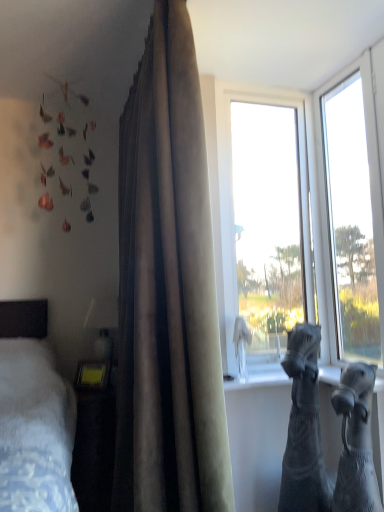
Where is `satin-like beige curtain at center`? The width and height of the screenshot is (384, 512). satin-like beige curtain at center is located at coordinates (168, 289).

The width and height of the screenshot is (384, 512). What do you see at coordinates (168, 289) in the screenshot?
I see `satin-like beige curtain at center` at bounding box center [168, 289].

Where is `transparent glass window at upper right, placed as the first window when sorted from right to left`? The height and width of the screenshot is (512, 384). transparent glass window at upper right, placed as the first window when sorted from right to left is located at coordinates (354, 213).

You are a GUI agent. You are given a task and a screenshot of the screen. Output one action in this format:
    pyautogui.click(x=<x>, y=<y>)
    Task: Click on the satin-like beige curtain at center
    The height and width of the screenshot is (512, 384).
    Given the screenshot: What is the action you would take?
    pyautogui.click(x=168, y=289)

From a real-world perspective, is satin-like beige curtain at center positioned over transparent glass window at upper right, placed as the first window when sorted from right to left, based on gravity?

No, from a real-world perspective, satin-like beige curtain at center is not on top of transparent glass window at upper right, placed as the first window when sorted from right to left.

Image resolution: width=384 pixels, height=512 pixels. I want to click on the 1st window behind when counting from the satin-like beige curtain at center, so click(354, 213).

How different are the orientations of satin-like beige curtain at center and transparent glass window at upper right, placed as the first window when sorted from right to left, in degrees?

They differ by 0.187 degrees in their facing directions.

Is satin-like beige curtain at center facing away from transparent glass window at upper right, which is the 2th window from left to right?

Yes, satin-like beige curtain at center's orientation is away from transparent glass window at upper right, which is the 2th window from left to right.

Does transparent glass window at upper right, positioned as the first window in left-to-right order, have a smaller size compared to transparent glass window at upper right, placed as the first window when sorted from right to left?

Incorrect, transparent glass window at upper right, positioned as the first window in left-to-right order, is not smaller in size than transparent glass window at upper right, placed as the first window when sorted from right to left.

How far apart are transparent glass window at upper right, positioned as the first window in left-to-right order, and transparent glass window at upper right, placed as the first window when sorted from right to left?

The distance of transparent glass window at upper right, positioned as the first window in left-to-right order, from transparent glass window at upper right, placed as the first window when sorted from right to left, is 14.71 centimeters.

What's the angular difference between transparent glass window at upper right, which is counted as the second window, starting from the right, and transparent glass window at upper right, placed as the first window when sorted from right to left,'s facing directions?

The angular difference between transparent glass window at upper right, which is counted as the second window, starting from the right, and transparent glass window at upper right, placed as the first window when sorted from right to left, is 90 degrees.

Is transparent glass window at upper right, which is counted as the second window, starting from the right, with transparent glass window at upper right, placed as the first window when sorted from right to left?

No, transparent glass window at upper right, which is counted as the second window, starting from the right, is not touching transparent glass window at upper right, placed as the first window when sorted from right to left.

Is transparent glass window at upper right, which is counted as the second window, starting from the right, positioned before satin-like beige curtain at center?

No, the depth of transparent glass window at upper right, which is counted as the second window, starting from the right, is greater than that of satin-like beige curtain at center.

Can you confirm if transparent glass window at upper right, positioned as the first window in left-to-right order, is positioned to the right of satin-like beige curtain at center?

Yes.

From the picture: How much distance is there between transparent glass window at upper right, which is counted as the second window, starting from the right, and satin-like beige curtain at center?

They are 65.28 centimeters apart.

Consider the image. What's the angular difference between transparent glass window at upper right, positioned as the first window in left-to-right order, and satin-like beige curtain at center's facing directions?

transparent glass window at upper right, positioned as the first window in left-to-right order, and satin-like beige curtain at center are facing 89.8 degrees away from each other.

Which is closer, (350, 386) or (141, 152)?

The point (350, 386) is more forward.

Could satin-like beige curtain at center be considered to be inside black knitted socks at lower right, positioned as the 1th animal in front-to-back order?

No, satin-like beige curtain at center is located outside of black knitted socks at lower right, positioned as the 1th animal in front-to-back order.

From a real-world perspective, is black knitted socks at lower right, positioned as the second animal in back-to-front order, above or below satin-like beige curtain at center?

black knitted socks at lower right, positioned as the second animal in back-to-front order, is situated lower than satin-like beige curtain at center in the real world.

Which is more to the right, black knitted socks at lower right, positioned as the 1th animal in front-to-back order, or satin-like beige curtain at center?

From the viewer's perspective, black knitted socks at lower right, positioned as the 1th animal in front-to-back order, appears more on the right side.

Could you tell me if transparent glass window at upper right, placed as the first window when sorted from right to left, is turned towards black denim jeans at lower right, the first animal positioned from the back?

Yes, transparent glass window at upper right, placed as the first window when sorted from right to left, is aimed at black denim jeans at lower right, the first animal positioned from the back.

From a real-world perspective, which object stands above the other?

transparent glass window at upper right, which is the 2th window from left to right, is physically above.

Is transparent glass window at upper right, placed as the first window when sorted from right to left, thinner than black denim jeans at lower right, the first animal positioned from the back?

Yes, transparent glass window at upper right, placed as the first window when sorted from right to left, is thinner than black denim jeans at lower right, the first animal positioned from the back.

Consider the image. Can you tell me how much transparent glass window at upper right, placed as the first window when sorted from right to left, and black denim jeans at lower right, positioned as the second animal in front-to-back order, differ in facing direction?

The angle between the facing direction of transparent glass window at upper right, placed as the first window when sorted from right to left, and the facing direction of black denim jeans at lower right, positioned as the second animal in front-to-back order, is 20.1 degrees.

Is black denim jeans at lower right, positioned as the second animal in front-to-back order, turned away from transparent glass window at upper right, which is counted as the second window, starting from the right?

black denim jeans at lower right, positioned as the second animal in front-to-back order, does not have its back to transparent glass window at upper right, which is counted as the second window, starting from the right.

Between black denim jeans at lower right, positioned as the second animal in front-to-back order, and transparent glass window at upper right, positioned as the first window in left-to-right order, which one has less height?

black denim jeans at lower right, positioned as the second animal in front-to-back order.

Can you confirm if satin-like beige curtain at center is bigger than transparent glass window at upper right, which is counted as the second window, starting from the right?

Yes.

Based on their positions, is satin-like beige curtain at center located to the left or right of transparent glass window at upper right, which is counted as the second window, starting from the right?

satin-like beige curtain at center is positioned on transparent glass window at upper right, which is counted as the second window, starting from the right,'s left side.

Is the depth of satin-like beige curtain at center less than that of transparent glass window at upper right, which is counted as the second window, starting from the right?

Yes, satin-like beige curtain at center is closer to the camera.

From a real-world perspective, is satin-like beige curtain at center positioned over transparent glass window at upper right, which is counted as the second window, starting from the right, based on gravity?

No, from a real-world perspective, satin-like beige curtain at center is not above transparent glass window at upper right, which is counted as the second window, starting from the right.

Image resolution: width=384 pixels, height=512 pixels. Identify the location of curtain in front of the transparent glass window at upper right, which is the 2th window from left to right. (168, 289).

Where is `window on the left of transparent glass window at upper right, which is the 2th window from left to right`? The width and height of the screenshot is (384, 512). window on the left of transparent glass window at upper right, which is the 2th window from left to right is located at coordinates point(310,194).

Based on their spatial positions, is black knitted socks at lower right, positioned as the second animal in back-to-front order, or transparent glass window at upper right, positioned as the first window in left-to-right order, closer to satin-like beige curtain at center?

transparent glass window at upper right, positioned as the first window in left-to-right order.

Consider the image. From the image, which object appears to be nearer to transparent glass window at upper right, which is the 2th window from left to right, satin-like beige curtain at center or transparent glass window at upper right, positioned as the first window in left-to-right order?

transparent glass window at upper right, positioned as the first window in left-to-right order, is positioned closer to the anchor transparent glass window at upper right, which is the 2th window from left to right.

Which object lies nearer to the anchor point transparent glass window at upper right, which is the 2th window from left to right, transparent glass window at upper right, positioned as the first window in left-to-right order, or black knitted socks at lower right, positioned as the 1th animal in front-to-back order?

transparent glass window at upper right, positioned as the first window in left-to-right order, is closer to transparent glass window at upper right, which is the 2th window from left to right.

Based on their spatial positions, is black denim jeans at lower right, positioned as the second animal in front-to-back order, or black knitted socks at lower right, positioned as the 1th animal in front-to-back order, further from transparent glass window at upper right, which is the 2th window from left to right?

Based on the image, black knitted socks at lower right, positioned as the 1th animal in front-to-back order, appears to be further to transparent glass window at upper right, which is the 2th window from left to right.

Looking at the image, which one is located further to transparent glass window at upper right, which is the 2th window from left to right, black denim jeans at lower right, positioned as the second animal in front-to-back order, or satin-like beige curtain at center?

satin-like beige curtain at center lies further to transparent glass window at upper right, which is the 2th window from left to right, than the other object.

Looking at the image, which one is located further to satin-like beige curtain at center, black denim jeans at lower right, the first animal positioned from the back, or black knitted socks at lower right, positioned as the 1th animal in front-to-back order?

black knitted socks at lower right, positioned as the 1th animal in front-to-back order.

Based on their spatial positions, is black denim jeans at lower right, positioned as the second animal in front-to-back order, or transparent glass window at upper right, which is the 2th window from left to right, closer to black knitted socks at lower right, positioned as the second animal in back-to-front order?

black denim jeans at lower right, positioned as the second animal in front-to-back order, is closer to black knitted socks at lower right, positioned as the second animal in back-to-front order.

When comparing their distances from transparent glass window at upper right, which is counted as the second window, starting from the right, does black denim jeans at lower right, the first animal positioned from the back, or transparent glass window at upper right, which is the 2th window from left to right, seem further?

black denim jeans at lower right, the first animal positioned from the back, lies further to transparent glass window at upper right, which is counted as the second window, starting from the right, than the other object.

Identify the location of window located between satin-like beige curtain at center and transparent glass window at upper right, which is the 2th window from left to right, in the left-right direction. (310, 194).

You are a GUI agent. You are given a task and a screenshot of the screen. Output one action in this format:
    pyautogui.click(x=<x>, y=<y>)
    Task: Click on the animal between transparent glass window at upper right, which is counted as the second window, starting from the right, and black denim jeans at lower right, positioned as the second animal in front-to-back order, in the vertical direction
    The height and width of the screenshot is (512, 384).
    Given the screenshot: What is the action you would take?
    pyautogui.click(x=356, y=441)

Identify the location of animal located between satin-like beige curtain at center and black knitted socks at lower right, positioned as the second animal in back-to-front order, in the left-right direction. (304, 428).

I want to click on animal between transparent glass window at upper right, placed as the first window when sorted from right to left, and black denim jeans at lower right, positioned as the second animal in front-to-back order, in the up-down direction, so click(356, 441).